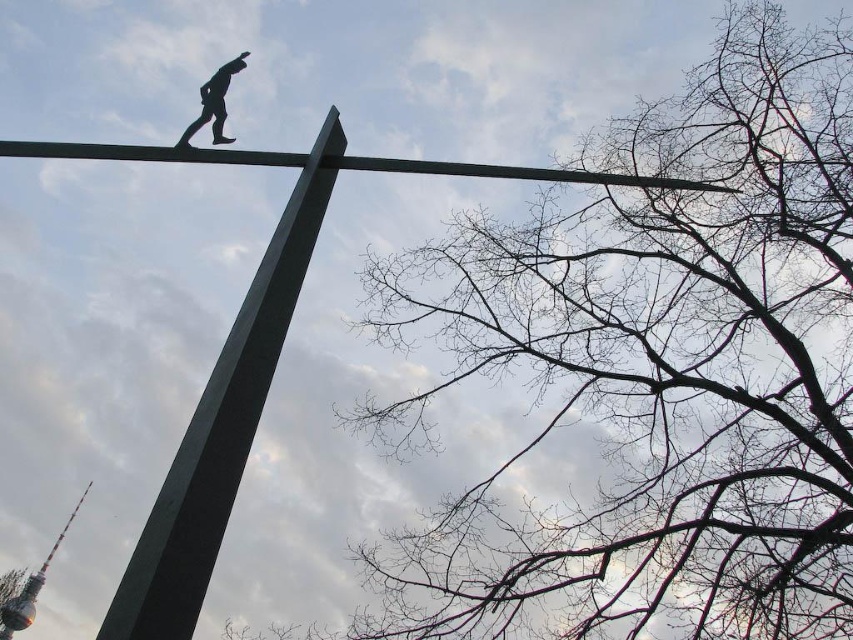
Where is `green polished metal pole at upper center`? green polished metal pole at upper center is located at coordinates (223, 422).

Can you confirm if green polished metal pole at upper center is taller than black matte figure at upper center?

Correct, green polished metal pole at upper center is much taller as black matte figure at upper center.

Between point (322, 196) and point (189, 129), which one is positioned in front?

Point (322, 196) is more forward.

Where is `green polished metal pole at upper center`? The image size is (853, 640). green polished metal pole at upper center is located at coordinates (223, 422).